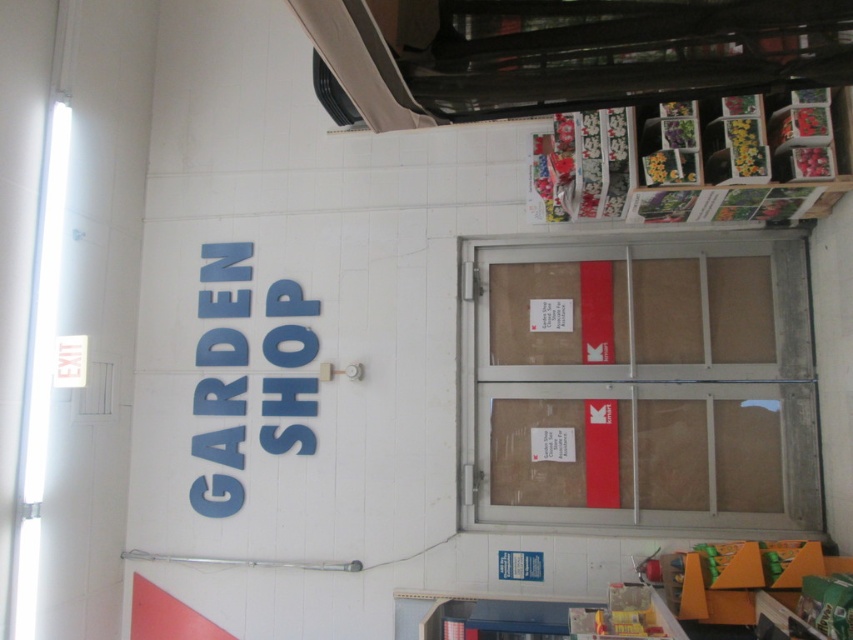
Can you confirm if black plastic exhaust hood at upper center is positioned below wooden shelves at upper right?

Actually, black plastic exhaust hood at upper center is above wooden shelves at upper right.

Who is higher up, black plastic exhaust hood at upper center or wooden shelves at upper right?

black plastic exhaust hood at upper center

Who is more distant from viewer, (749, 65) or (701, 145)?

The point (701, 145) is behind.

Where is `black plastic exhaust hood at upper center`? The image size is (853, 640). black plastic exhaust hood at upper center is located at coordinates (561, 52).

Based on the photo, is brown cardboard door at center shorter than wooden shelves at upper right?

No, brown cardboard door at center is not shorter than wooden shelves at upper right.

Who is more forward, (709, 253) or (625, 122)?

Positioned in front is point (625, 122).

Where is `brown cardboard door at center`? This screenshot has height=640, width=853. brown cardboard door at center is located at coordinates (639, 385).

Between brown cardboard door at center and black plastic exhaust hood at upper center, which one is positioned lower?

brown cardboard door at center is lower down.

Between point (762, 291) and point (767, 10), which one is positioned behind?

Point (762, 291)

Does point (747, 310) come closer to viewer compared to point (347, 13)?

No.

Identify the location of brown cardboard door at center. (639, 385).